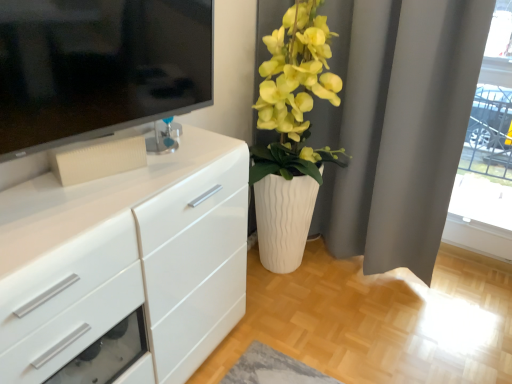
This screenshot has height=384, width=512. What are the coordinates of `free spot in front of white matte curtain at upper right` in the screenshot? It's located at (355, 330).